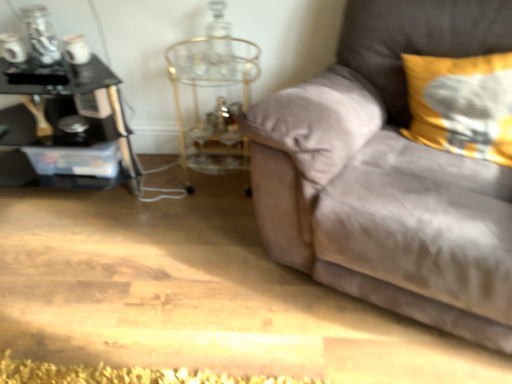
Identify the location of vacant space positioned to the left of suede couch at right. (169, 271).